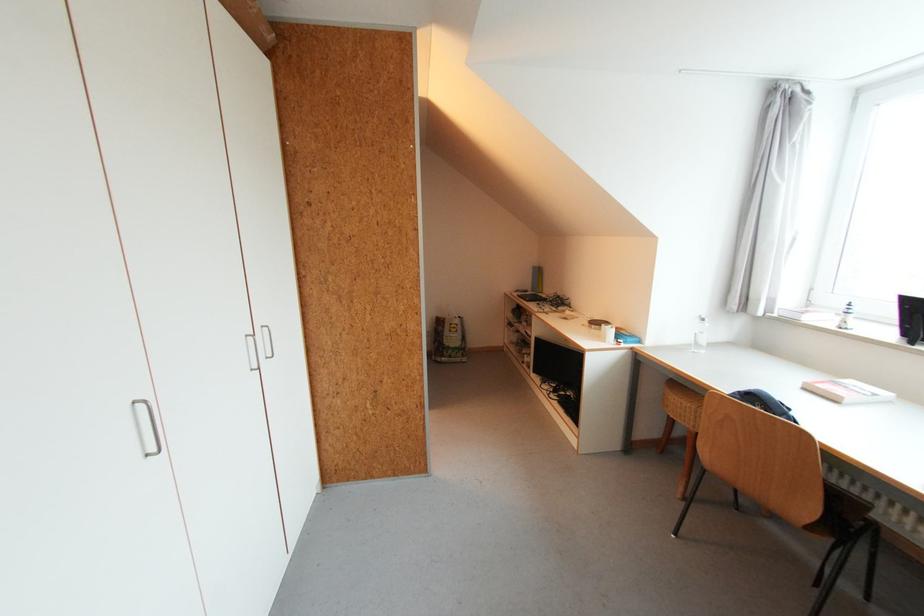
The width and height of the screenshot is (924, 616). What do you see at coordinates (626, 338) in the screenshot?
I see `the small blue box` at bounding box center [626, 338].